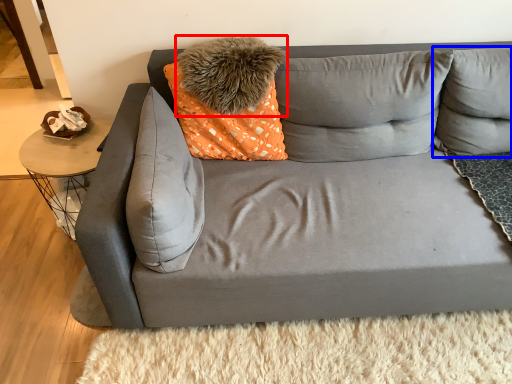
Question: Which object is further to the camera taking this photo, pillow (highlighted by a red box) or pillow (highlighted by a blue box)?

Choices:
 (A) pillow
 (B) pillow

Answer: (A)